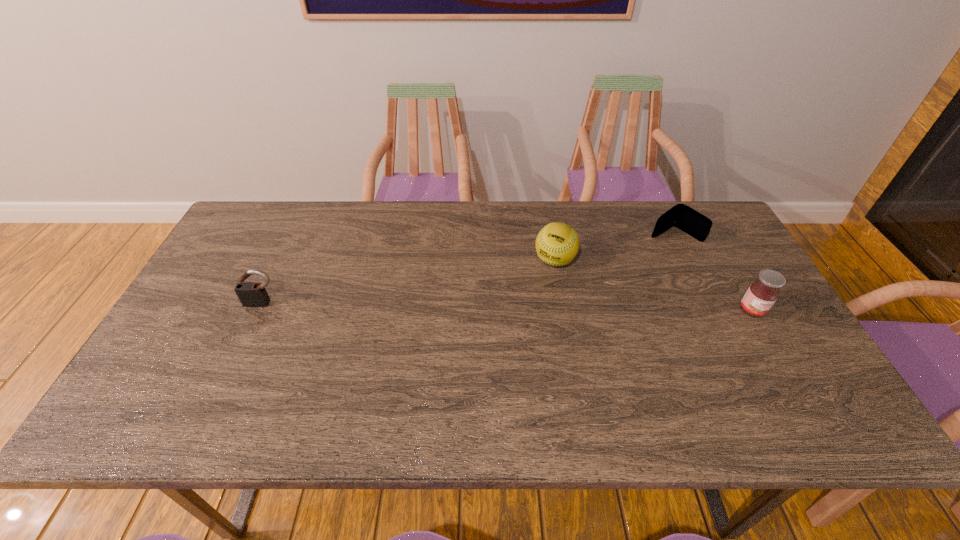
The image size is (960, 540). I want to click on blank region between the second farthest object and the jam, so click(654, 285).

At what (x,y) coordinates should I click in order to perform the action: click on empty space between the shortest object and the padlock. Please return your answer as a coordinate pair (x, y). The width and height of the screenshot is (960, 540). Looking at the image, I should click on (468, 269).

This screenshot has width=960, height=540. I want to click on vacant area that lies between the padlock and the jam, so [x=507, y=307].

Find the location of a particular element. free spot between the padlock and the shortest object is located at coordinates (468, 269).

You are a GUI agent. You are given a task and a screenshot of the screen. Output one action in this format:
    pyautogui.click(x=<x>, y=<y>)
    Task: Click on the vacant space that is in between the shortest object and the jam
    
    Given the screenshot: What is the action you would take?
    pyautogui.click(x=712, y=273)

Identify the location of the third closest object to the jam. (251, 294).

Locate which object is the closest to the jam. Please provide its 2D coordinates. Your answer should be formatted as a tuple, i.e. [(x, y)], where the tuple contains the x and y coordinates of a point satisfying the conditions above.

[(681, 216)]

The width and height of the screenshot is (960, 540). Find the location of `vacant point that satisfies the following two spatial constraints: 1. on the back side of the softball; 2. on the right side of the wallet`. vacant point that satisfies the following two spatial constraints: 1. on the back side of the softball; 2. on the right side of the wallet is located at coordinates (550, 234).